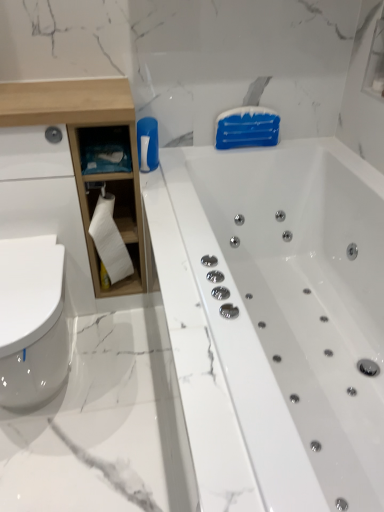
What are the coordinates of `vacant space underneath white glossy toilet at lower left (from a real-world perspective)` in the screenshot? It's located at (55, 391).